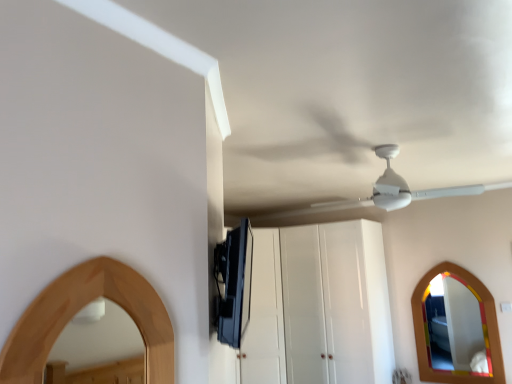
Question: Can you confirm if satin black tv at upper center is positioned to the left of white glossy cabinet at center?

Choices:
 (A) yes
 (B) no

Answer: (A)

Question: Does satin black tv at upper center appear on the right side of white glossy cabinet at center?

Choices:
 (A) yes
 (B) no

Answer: (B)

Question: Is satin black tv at upper center bigger than white glossy cabinet at center?

Choices:
 (A) no
 (B) yes

Answer: (A)

Question: From a real-world perspective, is satin black tv at upper center on top of white glossy cabinet at center?

Choices:
 (A) yes
 (B) no

Answer: (A)

Question: Considering the relative sizes of satin black tv at upper center and white glossy cabinet at center in the image provided, is satin black tv at upper center shorter than white glossy cabinet at center?

Choices:
 (A) yes
 (B) no

Answer: (A)

Question: Does satin black tv at upper center have a smaller size compared to white glossy cabinet at center?

Choices:
 (A) yes
 (B) no

Answer: (A)

Question: Can you confirm if white matte fan at upper center is positioned to the right of white glossy cabinet at center?

Choices:
 (A) no
 (B) yes

Answer: (B)

Question: Is white matte fan at upper center bigger than white glossy cabinet at center?

Choices:
 (A) no
 (B) yes

Answer: (A)

Question: Can you see white matte fan at upper center touching white glossy cabinet at center?

Choices:
 (A) no
 (B) yes

Answer: (A)

Question: Is white matte fan at upper center wider than white glossy cabinet at center?

Choices:
 (A) no
 (B) yes

Answer: (B)

Question: Does white matte fan at upper center have a greater height compared to white glossy cabinet at center?

Choices:
 (A) no
 (B) yes

Answer: (A)

Question: Is white matte fan at upper center not within white glossy cabinet at center?

Choices:
 (A) yes
 (B) no

Answer: (A)

Question: Is white glossy cabinet at center bigger than wooden mirror at lower right?

Choices:
 (A) no
 (B) yes

Answer: (B)